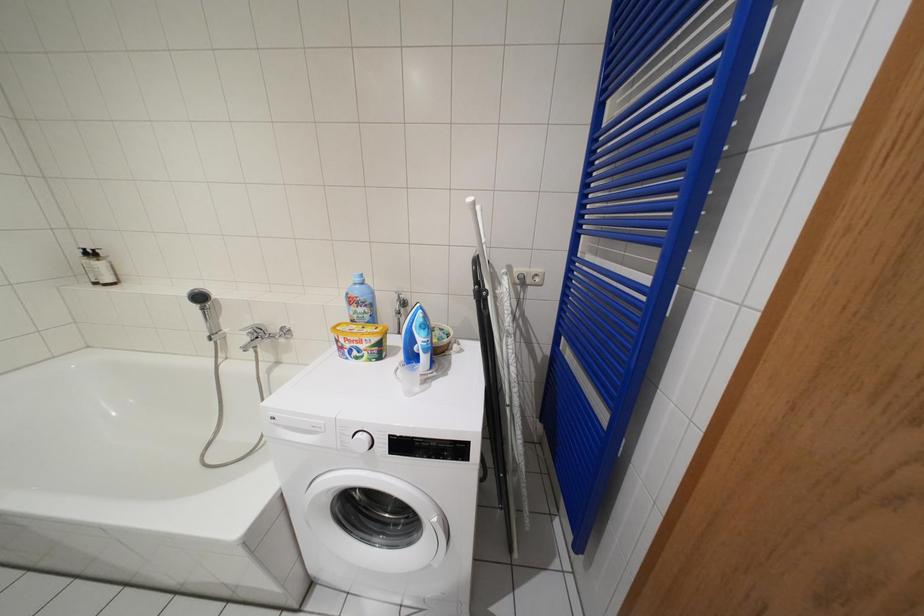
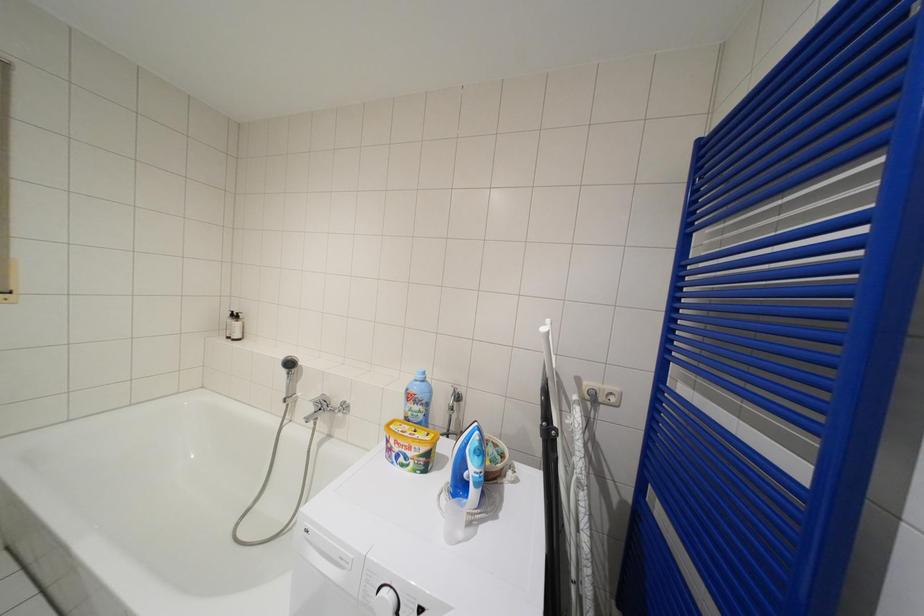
Question: Based on the continuous images, in which direction is the camera rotating? Reply with the corresponding letter.

Choices:
 (A) Left
 (B) Right
 (C) Up
 (D) Down

Answer: (C)